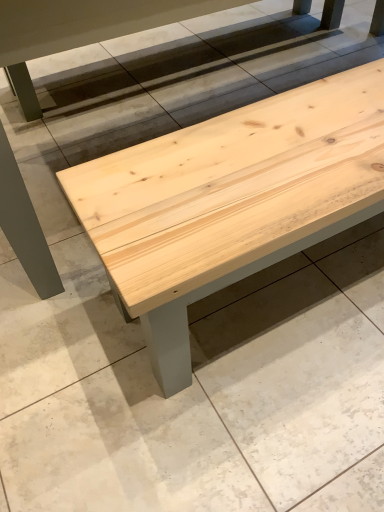
Question: Would you say natural wood bench at center is to the left or to the right of natural wood bench at center in the picture?

Choices:
 (A) right
 (B) left

Answer: (B)

Question: From a real-world perspective, is natural wood bench at center above or below natural wood bench at center?

Choices:
 (A) below
 (B) above

Answer: (B)

Question: Considering the positions of natural wood bench at center and natural wood bench at center in the image, is natural wood bench at center wider or thinner than natural wood bench at center?

Choices:
 (A) thin
 (B) wide

Answer: (A)

Question: Is natural wood bench at center inside or outside of natural wood bench at center?

Choices:
 (A) inside
 (B) outside

Answer: (B)

Question: From a real-world perspective, relative to natural wood bench at center, is natural wood bench at center vertically above or below?

Choices:
 (A) below
 (B) above

Answer: (A)

Question: Is natural wood bench at center wider or thinner than natural wood bench at center?

Choices:
 (A) thin
 (B) wide

Answer: (B)

Question: From the image's perspective, is natural wood bench at center located above or below natural wood bench at center?

Choices:
 (A) below
 (B) above

Answer: (A)